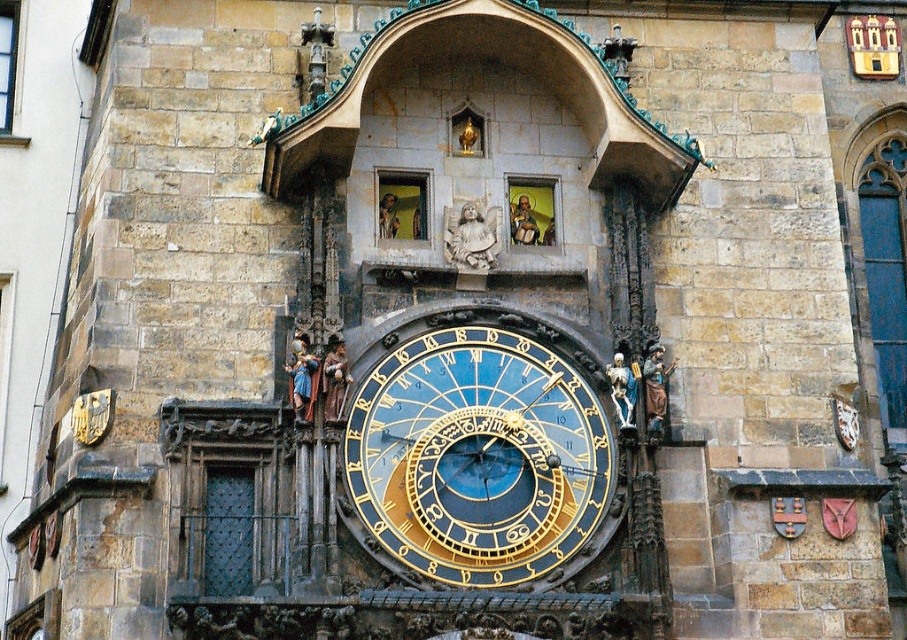
Does gold metallic clock at center appear under stone statue of an angel at center?

Yes, gold metallic clock at center is below stone statue of an angel at center.

Who is lower down, gold metallic clock at center or stone statue of an angel at center?

gold metallic clock at center

Where is `gold metallic clock at center`? This screenshot has width=907, height=640. gold metallic clock at center is located at coordinates (480, 460).